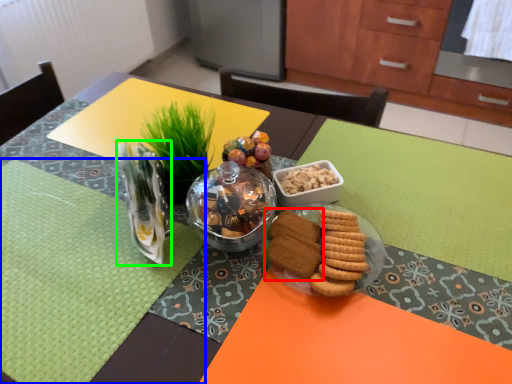
Question: Considering the real-world distances, which object is farthest from snack (highlighted by a red box)? place mat (highlighted by a blue box) or tableware (highlighted by a green box)?

Choices:
 (A) place mat
 (B) tableware

Answer: (A)